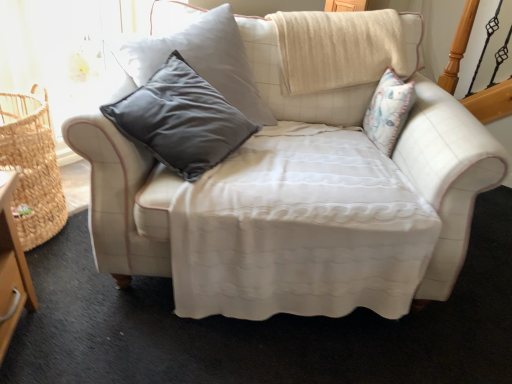
Question: Is white quilted fabric couch at center to the left of woven straw basket at left from the viewer's perspective?

Choices:
 (A) no
 (B) yes

Answer: (A)

Question: From the image's perspective, is white quilted fabric couch at center under woven straw basket at left?

Choices:
 (A) no
 (B) yes

Answer: (A)

Question: Is white quilted fabric couch at center in front of woven straw basket at left?

Choices:
 (A) no
 (B) yes

Answer: (B)

Question: From the image's perspective, is white quilted fabric couch at center located above woven straw basket at left?

Choices:
 (A) no
 (B) yes

Answer: (B)

Question: Can you confirm if white quilted fabric couch at center is bigger than woven straw basket at left?

Choices:
 (A) yes
 (B) no

Answer: (A)

Question: Can you confirm if white quilted fabric couch at center is thinner than woven straw basket at left?

Choices:
 (A) yes
 (B) no

Answer: (B)

Question: Can you confirm if woven straw basket at left is thinner than white quilted fabric couch at center?

Choices:
 (A) no
 (B) yes

Answer: (B)

Question: Does woven straw basket at left have a smaller size compared to white quilted fabric couch at center?

Choices:
 (A) yes
 (B) no

Answer: (A)

Question: Is woven straw basket at left facing towards white quilted fabric couch at center?

Choices:
 (A) yes
 (B) no

Answer: (A)

Question: Is white quilted fabric couch at center inside woven straw basket at left?

Choices:
 (A) no
 (B) yes

Answer: (A)

Question: Is woven straw basket at left bigger than white quilted fabric couch at center?

Choices:
 (A) no
 (B) yes

Answer: (A)

Question: Does woven straw basket at left have a greater height compared to white quilted fabric couch at center?

Choices:
 (A) no
 (B) yes

Answer: (A)

Question: In terms of width, does woven straw basket at left look wider or thinner when compared to white quilted fabric couch at center?

Choices:
 (A) wide
 (B) thin

Answer: (B)